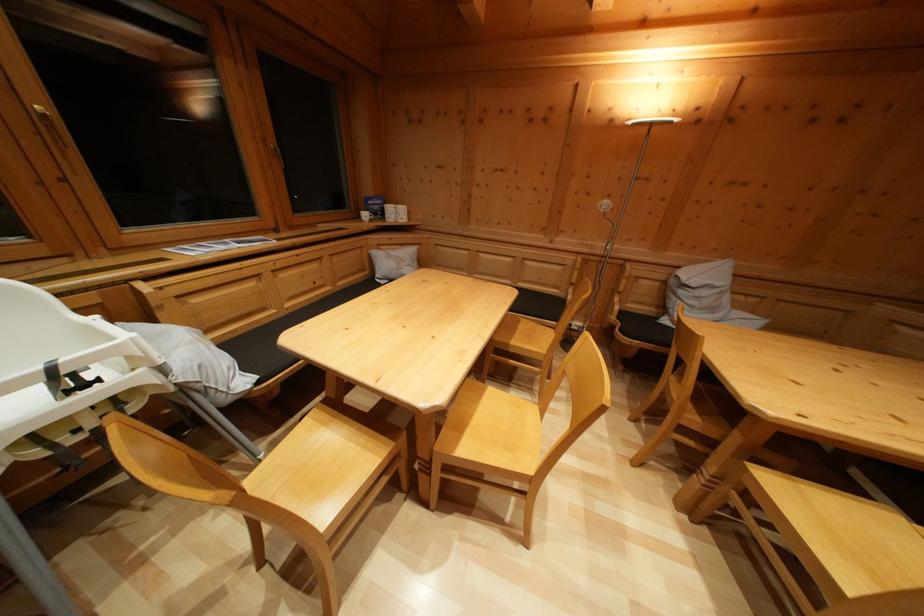
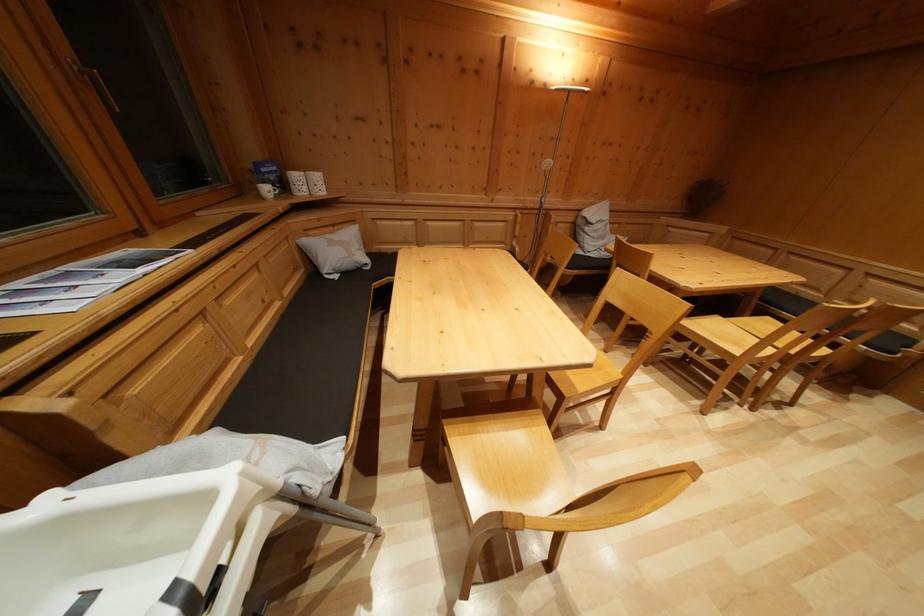
In the second image, find the point that corresponds to point 407,252 in the first image.

(338, 233)